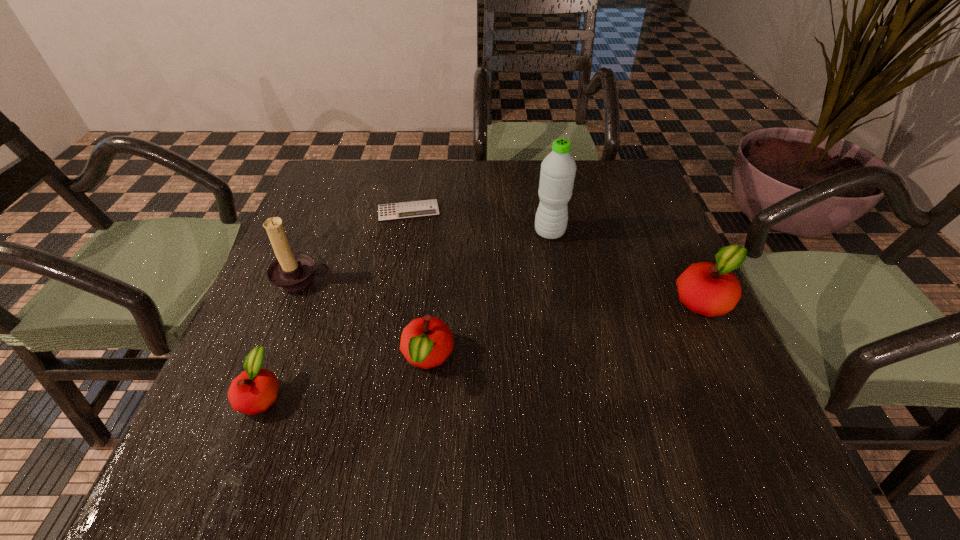
I want to click on vacant area between the shortest object and the third tallest object, so click(557, 255).

This screenshot has height=540, width=960. Find the location of `vacant region between the second shortest object and the fifth nearest object`. vacant region between the second shortest object and the fifth nearest object is located at coordinates (405, 313).

What are the coordinates of `vacant space in between the fifth nearest object and the fifth shortest object` in the screenshot? It's located at (425, 256).

This screenshot has height=540, width=960. In order to click on free space between the second object from right to left and the second apple from right to left in this screenshot , I will do `click(489, 295)`.

Image resolution: width=960 pixels, height=540 pixels. What are the coordinates of `free space between the fifth tallest object and the candle holder` in the screenshot? It's located at (281, 336).

Find the location of a particular element. free space between the second shortest object and the tallest object is located at coordinates (405, 313).

This screenshot has width=960, height=540. In order to click on vacant area that lies between the rightmost apple and the farthest object in this screenshot , I will do `click(557, 255)`.

This screenshot has height=540, width=960. Find the location of `free space between the fourth shortest object and the second tallest object`. free space between the fourth shortest object and the second tallest object is located at coordinates (503, 289).

Select which object is the fifth closest to the second tallest object. Please provide its 2D coordinates. Your answer should be formatted as a tuple, i.e. [(x, y)], where the tuple contains the x and y coordinates of a point satisfying the conditions above.

[(709, 289)]

Select which object is the third closest to the rightmost object. Please provide its 2D coordinates. Your answer should be formatted as a tuple, i.e. [(x, y)], where the tuple contains the x and y coordinates of a point satisfying the conditions above.

[(426, 208)]